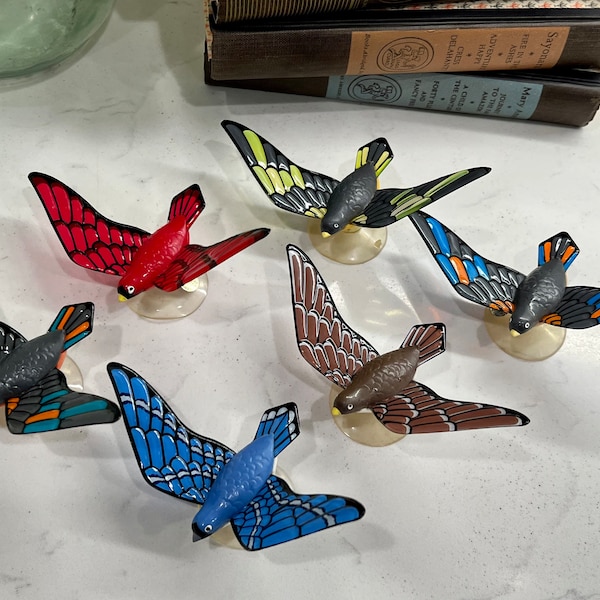
At what (x,y) coordinates should I click in order to perform the action: click on white marble surface. Please return your answer as a coordinate pair (x, y). This screenshot has width=600, height=600. Looking at the image, I should click on (491, 525).